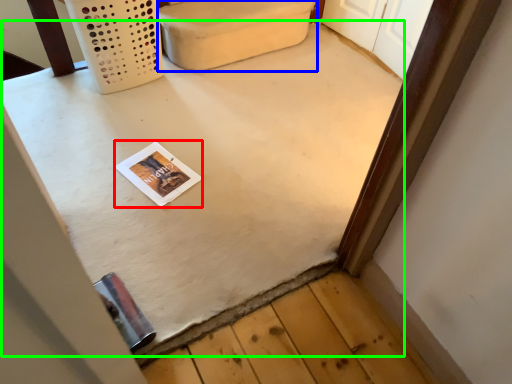
Question: Which object is the farthest from magazine (highlighted by a red box)? Choose among these: furniture (highlighted by a blue box) or table (highlighted by a green box).

Choices:
 (A) furniture
 (B) table

Answer: (A)